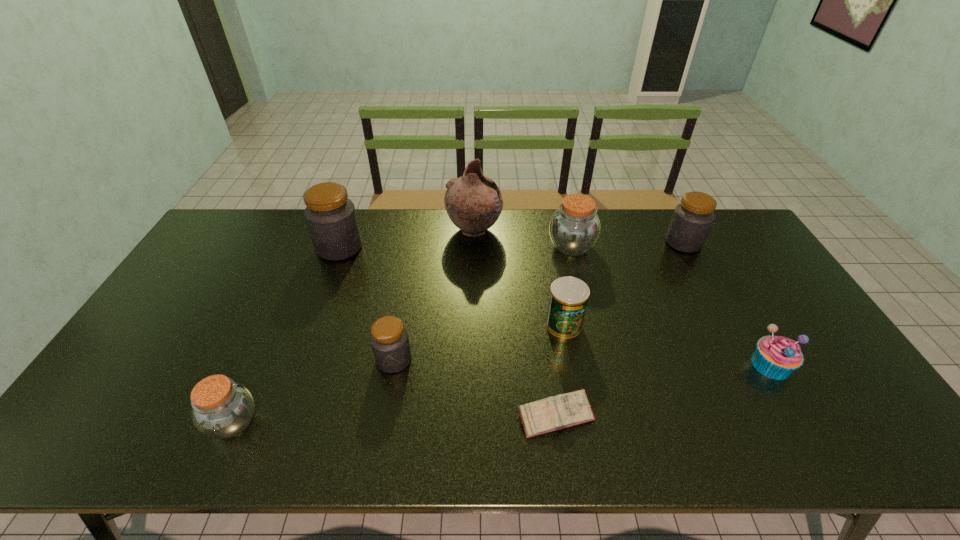
Point out which gray jar is positioned as the nearest to the blue muffin. Please provide its 2D coordinates. Your answer should be formatted as a tuple, i.e. [(x, y)], where the tuple contains the x and y coordinates of a point satisfying the conditions above.

[(692, 219)]

What are the coordinates of `gray jar that stands as the closest to the tallest jar` in the screenshot? It's located at (389, 339).

Find the location of a particular element. This screenshot has width=960, height=540. free point that satisfies the following two spatial constraints: 1. on the back side of the blue muffin; 2. from the spout of the pottery is located at coordinates (692, 230).

Identify the location of vacant space that satisfies the following two spatial constraints: 1. from the spout of the tallest object; 2. on the surface of the nearest gray jar near the warning symbol. This screenshot has width=960, height=540. (472, 360).

You are a GUI agent. You are given a task and a screenshot of the screen. Output one action in this format:
    pyautogui.click(x=<x>, y=<y>)
    Task: Click on the free spot that satisfies the following two spatial constraints: 1. on the surface of the rightmost jar near the warning symbol; 2. on the surface of the smallest gray jar near the warning symbol
    The height and width of the screenshot is (540, 960).
    Given the screenshot: What is the action you would take?
    pyautogui.click(x=746, y=360)

This screenshot has width=960, height=540. What are the coordinates of `vacant space that satisfies the following two spatial constraints: 1. on the back side of the muffin; 2. on the right side of the nearest jar` in the screenshot? It's located at (258, 365).

Identify the location of free space that satisfies the following two spatial constraints: 1. on the front side of the blue muffin; 2. on the right side of the fifth nearest object. (571, 365).